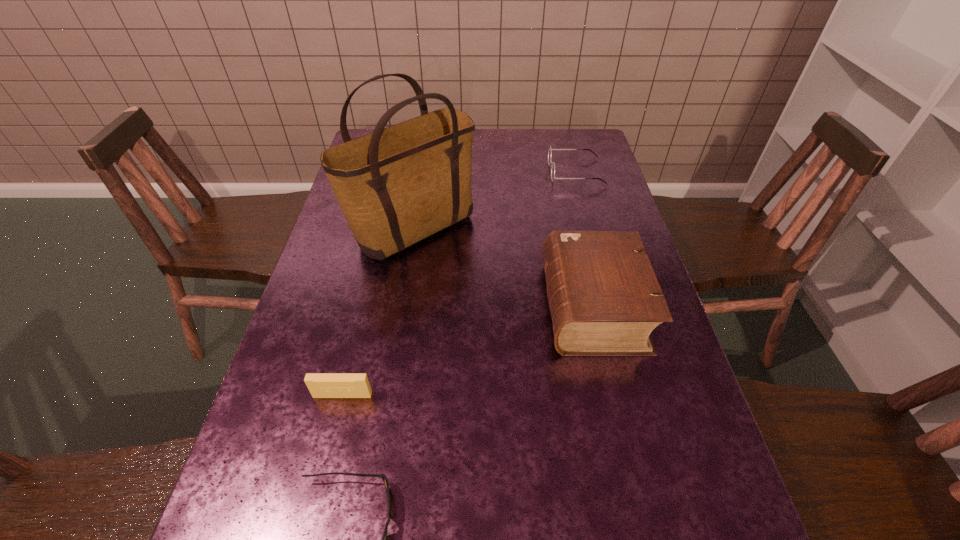
Where is `vacant space at the far right corner`? Image resolution: width=960 pixels, height=540 pixels. vacant space at the far right corner is located at coordinates (570, 138).

In order to click on vacant area that lies between the tote bag and the videotape in this screenshot , I will do `click(378, 314)`.

The image size is (960, 540). I want to click on free point between the tallest object and the fourth farthest object, so click(x=378, y=314).

You are a GUI agent. You are given a task and a screenshot of the screen. Output one action in this format:
    pyautogui.click(x=<x>, y=<y>)
    Task: Click on the free point between the Bible and the tote bag
    The height and width of the screenshot is (540, 960).
    Given the screenshot: What is the action you would take?
    pyautogui.click(x=504, y=269)

This screenshot has width=960, height=540. Find the location of `free space between the fourth farthest object and the spectacles`. free space between the fourth farthest object and the spectacles is located at coordinates (459, 284).

Identify which object is the second nearest to the Bible. Please provide its 2D coordinates. Your answer should be formatted as a tuple, i.e. [(x, y)], where the tuple contains the x and y coordinates of a point satisfying the conditions above.

[(550, 150)]

Identify the location of the third closest object to the farthest object. This screenshot has width=960, height=540. (321, 385).

Where is `vacant space that satisfies the following two spatial constraints: 1. on the spine side of the Bible; 2. at the front of the fourth farthest object with spools`? The width and height of the screenshot is (960, 540). vacant space that satisfies the following two spatial constraints: 1. on the spine side of the Bible; 2. at the front of the fourth farthest object with spools is located at coordinates (614, 395).